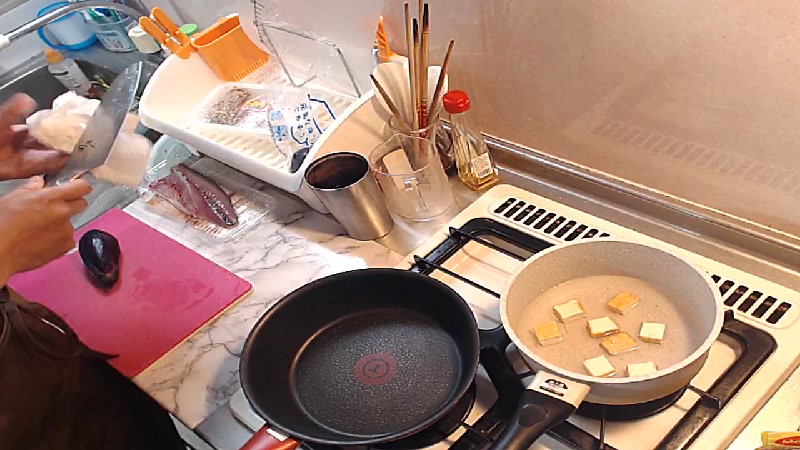
Where is `wall`? This screenshot has width=800, height=450. wall is located at coordinates (640, 56).